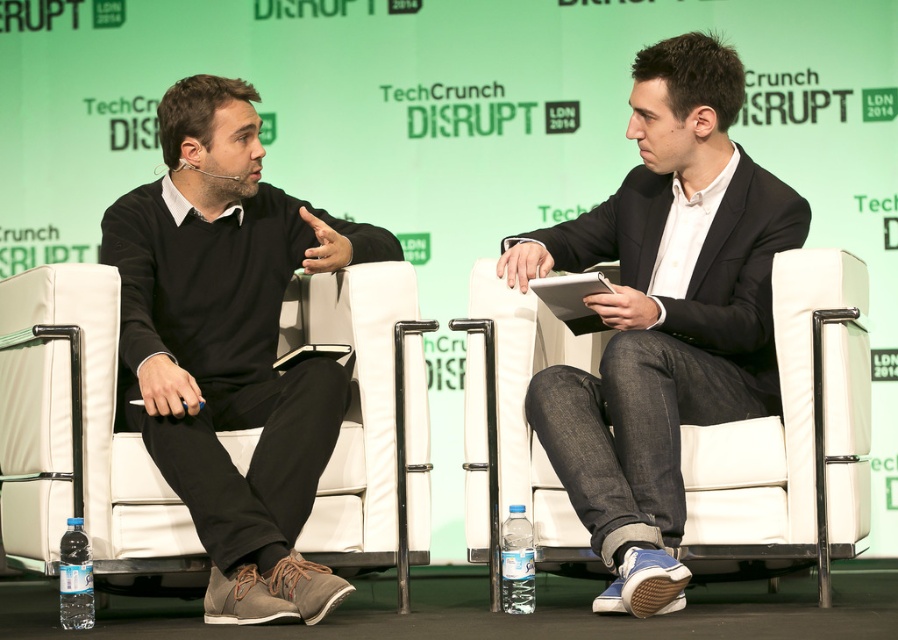
You are a photographer setting up for a photo shoot at the TechCrunch Disrupt event. You need to place a large camera tripod between the two chairs. Which chair, the white leather chair at left or the white leather chair at center, should you position the tripod closer to ensure it fits within the space between them?

The white leather chair at left is wider than the white leather chair at center. To ensure the tripod fits, position it closer to the narrower white leather chair at center.

You are at the TechCrunch Disrupt event in London 2014 and want to sit in one of the white leather chairs. If you walk straight towards the stage, which chair will you reach first, the white leather chair at left or the white leather chair at center?

The white leather chair at left is closer to the viewer, so you will reach it first when walking straight towards the stage.